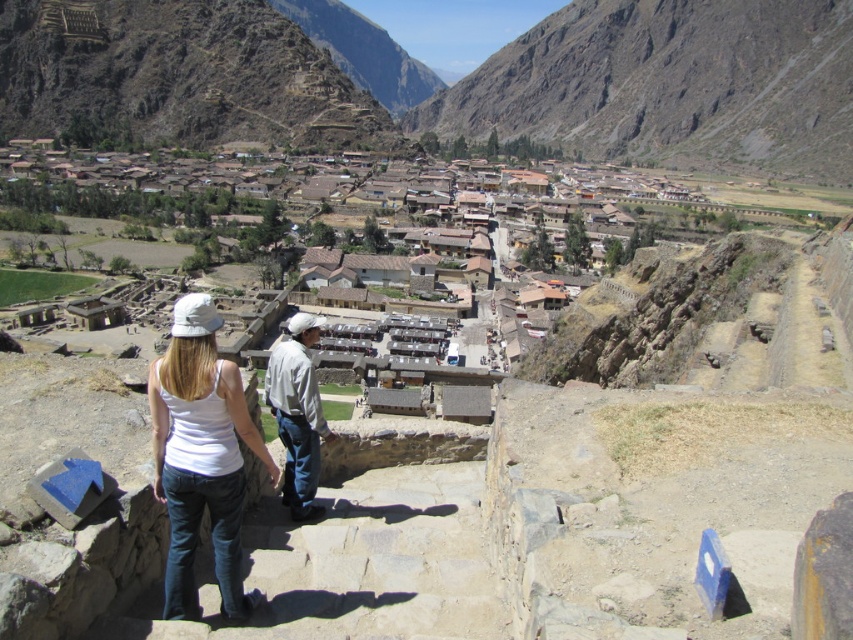
Question: Which object is positioned farthest from the white cotton tank top at center?

Choices:
 (A) light gray cotton shirt at center
 (B) brown rocky mountain at upper center

Answer: (B)

Question: Among these objects, which one is farthest from the camera?

Choices:
 (A) light gray cotton shirt at center
 (B) brown rocky mountain at upper center

Answer: (B)

Question: Is brown rocky mountain at upper center closer to the viewer compared to light gray cotton shirt at center?

Choices:
 (A) no
 (B) yes

Answer: (A)

Question: Which object appears farthest from the camera in this image?

Choices:
 (A) brown rocky mountain at upper center
 (B) white cotton tank top at center
 (C) light gray cotton shirt at center

Answer: (A)

Question: Does brown rocky mountain at upper center appear on the right side of white cotton tank top at center?

Choices:
 (A) no
 (B) yes

Answer: (B)

Question: Does brown rocky mountain at upper center appear under light gray cotton shirt at center?

Choices:
 (A) yes
 (B) no

Answer: (B)